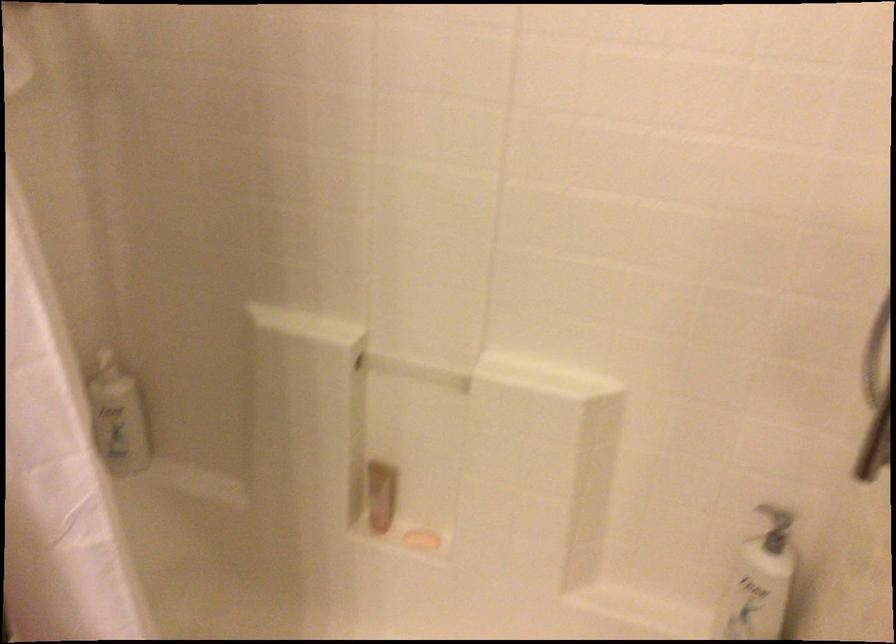
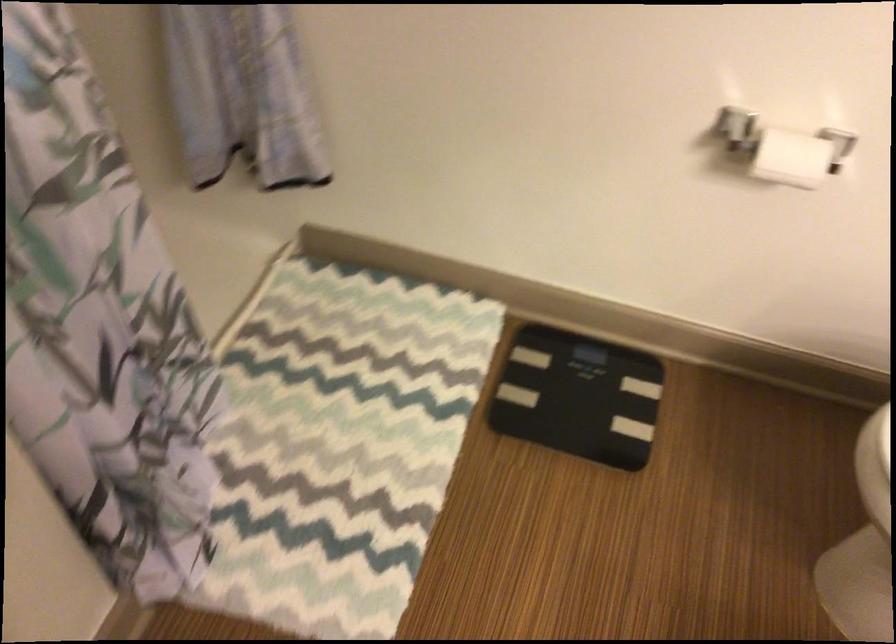
First-person continuous shooting, in which direction is the camera rotating?

The camera's rotation is toward right-down.